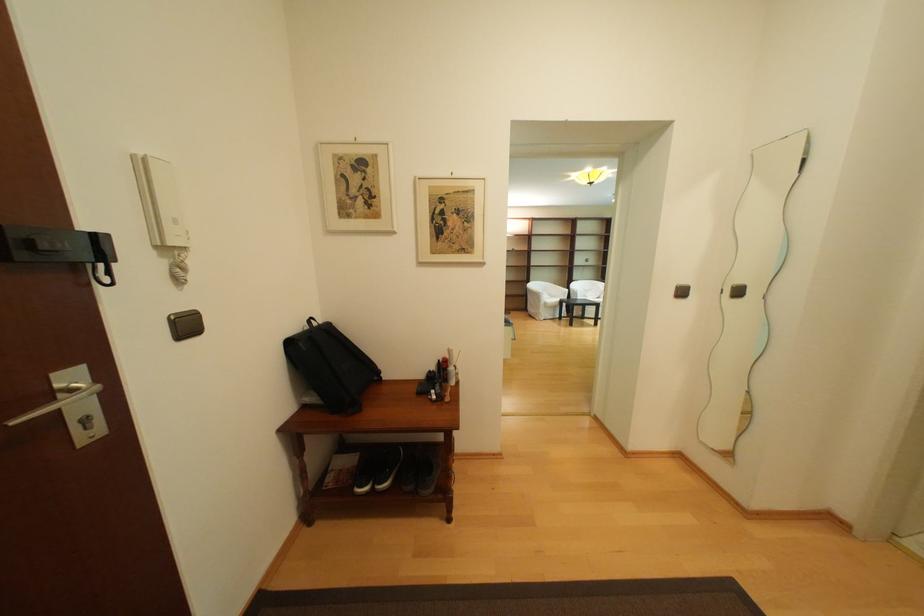
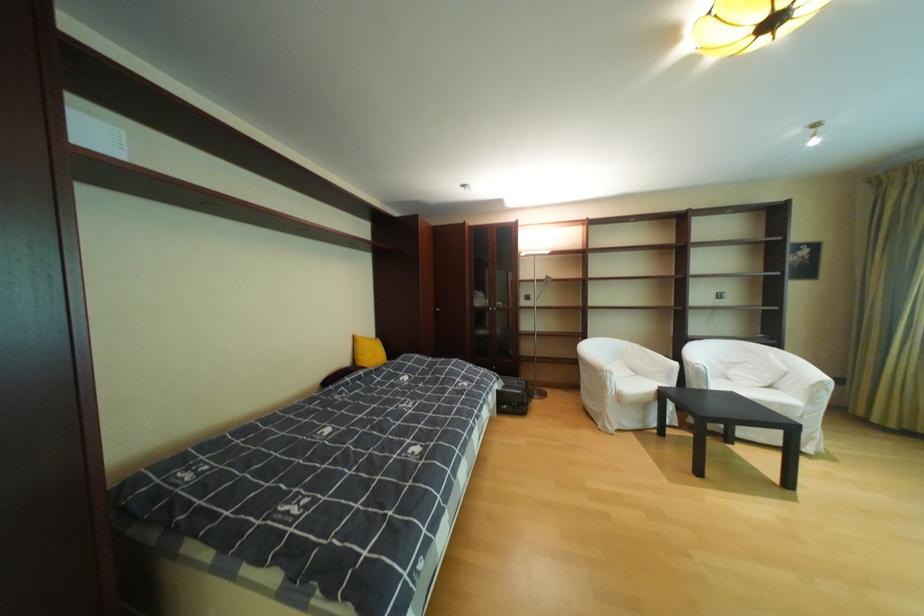
Locate, in the second image, the point that corresponds to point (578, 291) in the first image.

(687, 365)